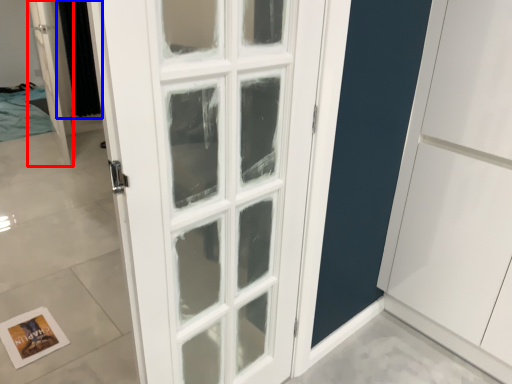
Question: Which of the following is the farthest to the observer, door (highlighted by a red box) or curtain (highlighted by a blue box)?

Choices:
 (A) door
 (B) curtain

Answer: (B)